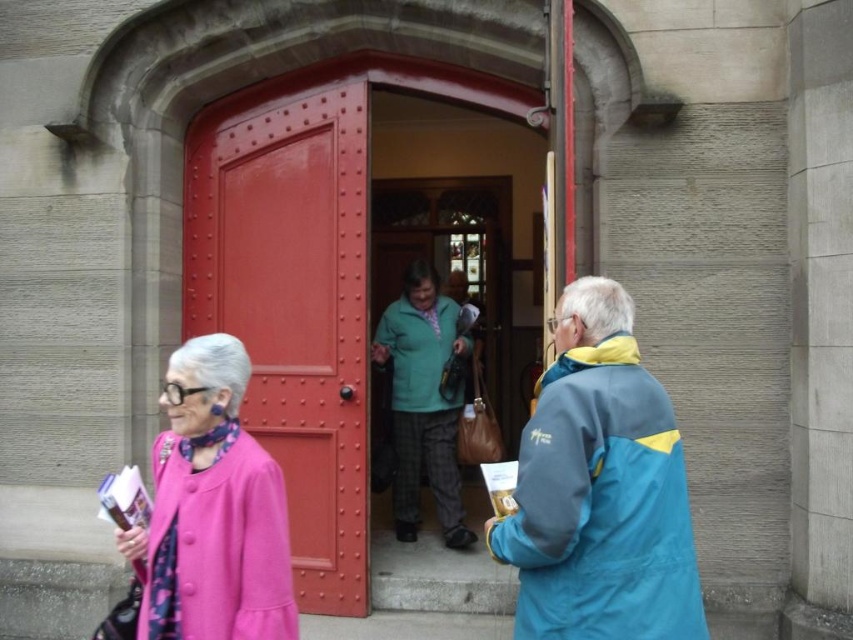
Is smooth glossy wood door at center positioned behind teal fabric jacket at center?

Yes, it is behind teal fabric jacket at center.

How much distance is there between smooth glossy wood door at center and teal fabric jacket at center?

The distance of smooth glossy wood door at center from teal fabric jacket at center is 2.16 meters.

Which is behind, point (256, 204) or point (561, 596)?

The point (256, 204) is behind.

Locate an element on the screen. Image resolution: width=853 pixels, height=640 pixels. smooth glossy wood door at center is located at coordinates (292, 307).

Between pink woolen coat at left and green matte coat at center, which one appears on the right side from the viewer's perspective?

Positioned to the right is green matte coat at center.

How distant is pink woolen coat at left from green matte coat at center?

pink woolen coat at left and green matte coat at center are 8.85 feet apart from each other.

Is point (224, 573) positioned in front of point (447, 320)?

Yes, point (224, 573) is closer to viewer.

You are a GUI agent. You are given a task and a screenshot of the screen. Output one action in this format:
    pyautogui.click(x=<x>, y=<y>)
    Task: Click on the pink woolen coat at left
    
    Given the screenshot: What is the action you would take?
    pyautogui.click(x=212, y=509)

Is blue/yellow fabric jacket at right taller than green matte coat at center?

Indeed, blue/yellow fabric jacket at right has a greater height compared to green matte coat at center.

Can you confirm if blue/yellow fabric jacket at right is positioned to the left of green matte coat at center?

In fact, blue/yellow fabric jacket at right is to the right of green matte coat at center.

What do you see at coordinates (601, 506) in the screenshot? The height and width of the screenshot is (640, 853). I see `blue/yellow fabric jacket at right` at bounding box center [601, 506].

The width and height of the screenshot is (853, 640). Identify the location of blue/yellow fabric jacket at right. (601, 506).